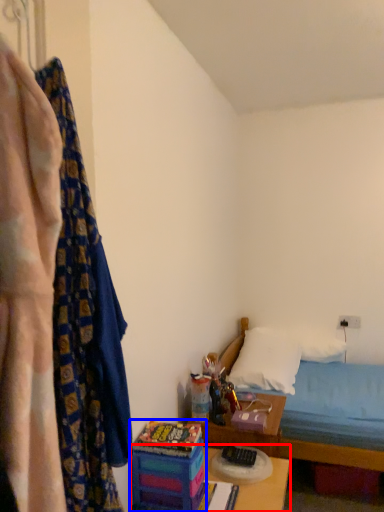
Question: Among these objects, which one is farthest to the camera, table (highlighted by a red box) or toy (highlighted by a blue box)?

Choices:
 (A) table
 (B) toy

Answer: (B)